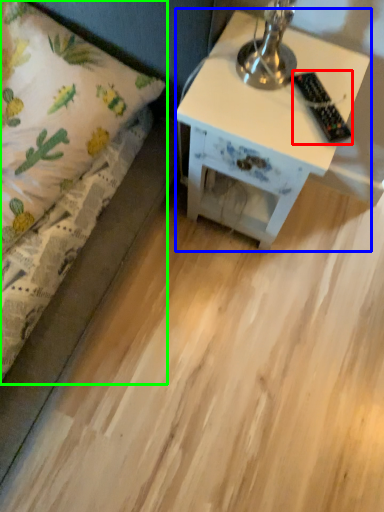
Question: Based on their relative distances, which object is farther from remote control (highlighted by a red box)? Choose from nightstand (highlighted by a blue box) and bed (highlighted by a green box).

Choices:
 (A) nightstand
 (B) bed

Answer: (B)